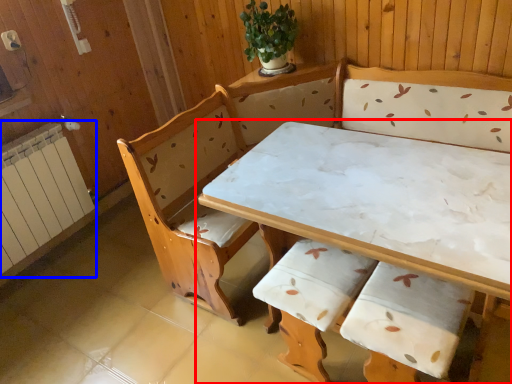
Question: Which object appears farthest to the camera in this image, table (highlighted by a red box) or radiator (highlighted by a blue box)?

Choices:
 (A) table
 (B) radiator

Answer: (B)